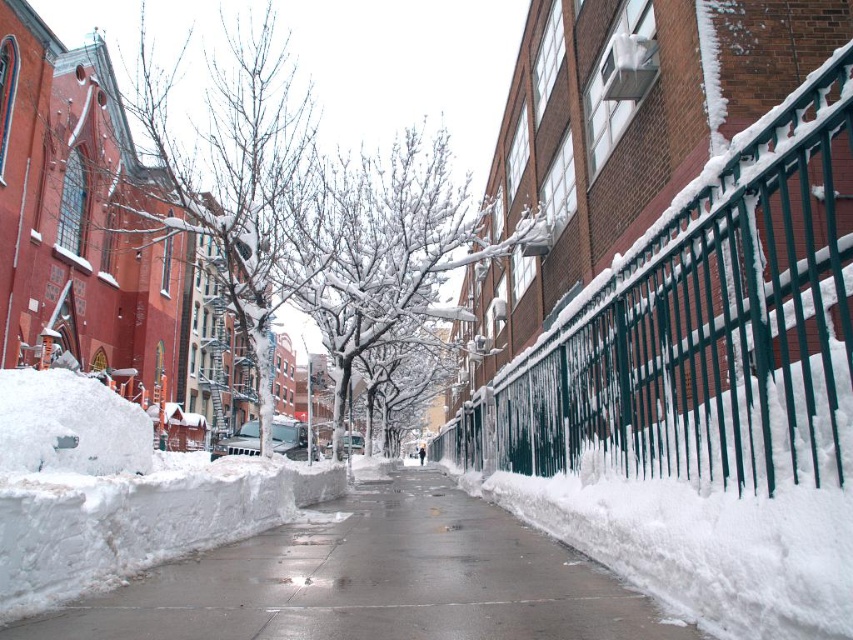
You are standing at the center of the snowy sidewalk and want to take a photo. There are two points marked in the scene, point 1 at coordinates point (79, 600) and point 2 at coordinates point (215, 353). Which point should you focus on to ensure it appears larger in your photo?

Point 1 at coordinates point (79, 600) should be focused on because it is closer to the camera and will appear larger in the photo compared to point 2 at coordinates point (215, 353) which is further away.